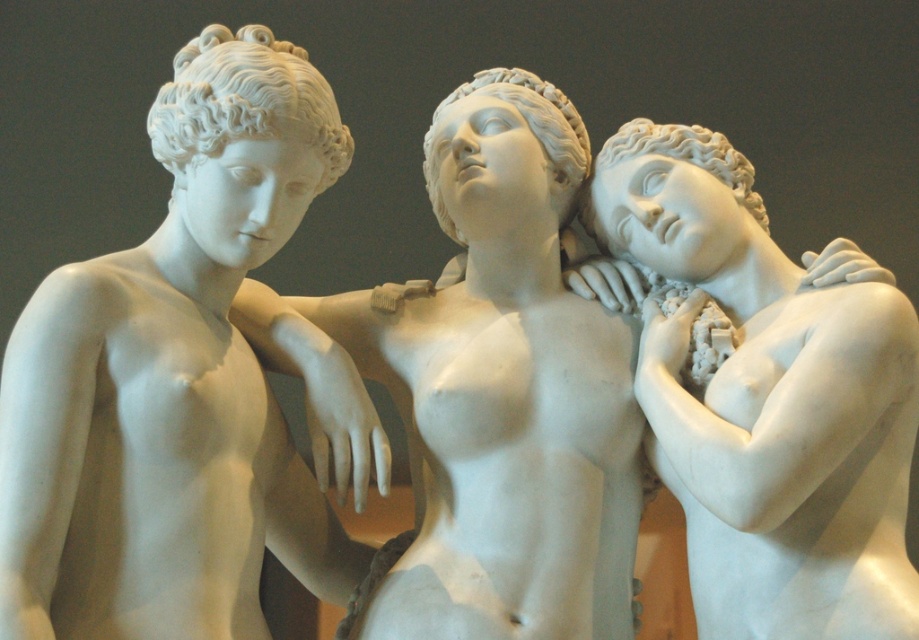
Which is more to the left, white marble statue at center or white marble statue at right?

Positioned to the left is white marble statue at center.

Is point (577, 596) positioned before point (786, 356)?

No, it is behind (786, 356).

Find the location of a particular element. white marble statue at center is located at coordinates (502, 392).

The image size is (919, 640). What are the coordinates of `white marble statue at center` in the screenshot? It's located at (502, 392).

Who is positioned more to the right, white marble statue at left or white marble statue at center?

Positioned to the right is white marble statue at center.

Does point (48, 524) come in front of point (403, 406)?

Yes, point (48, 524) is closer to viewer.

Does point (269, 413) come in front of point (600, 369)?

That is True.

Where is `white marble statue at left`? The width and height of the screenshot is (919, 640). white marble statue at left is located at coordinates pyautogui.click(x=186, y=381).

Does white marble statue at left come in front of white marble statue at right?

Yes, it is.

Does white marble statue at left appear on the left side of white marble statue at right?

Yes, white marble statue at left is to the left of white marble statue at right.

Does point (286, 332) lie behind point (892, 317)?

Yes, it is behind point (892, 317).

Identify the location of white marble statue at left. (186, 381).